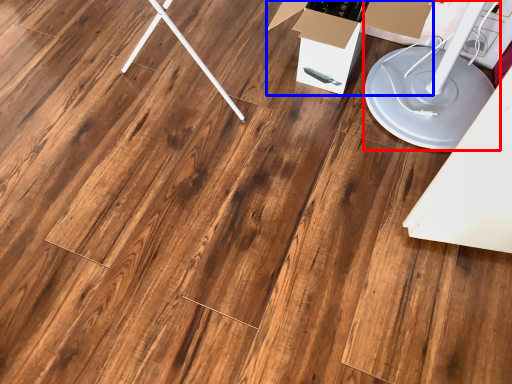
Question: Which object appears closest to the camera in this image, lift (highlighted by a red box) or cardboard box (highlighted by a blue box)?

Choices:
 (A) lift
 (B) cardboard box

Answer: (A)